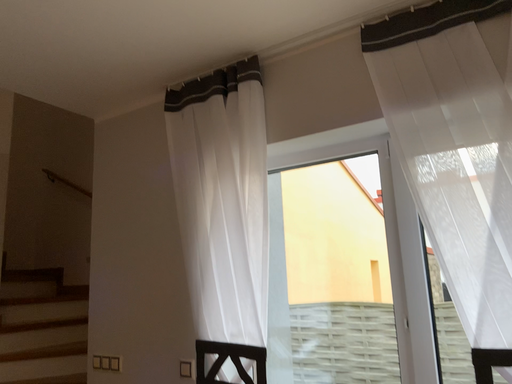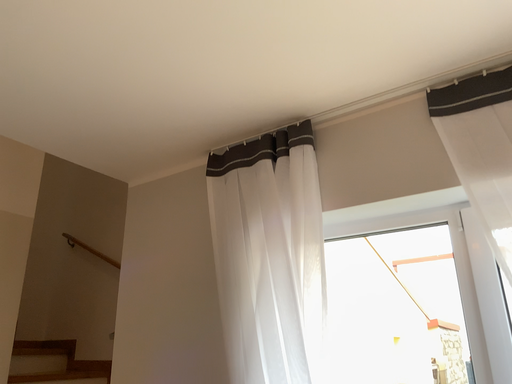
Question: Which way did the camera rotate in the video?

Choices:
 (A) rotated upward
 (B) rotated downward

Answer: (A)